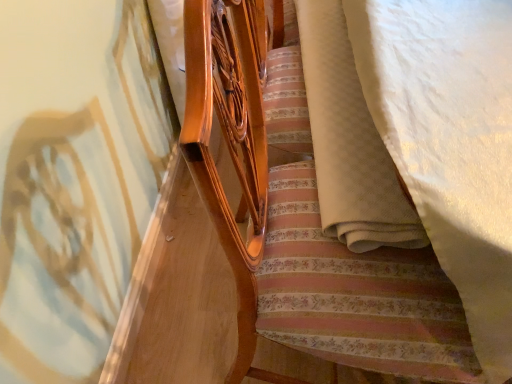
Question: In terms of height, does white textured blanket at lower right look taller or shorter compared to matte wood bed frame at center?

Choices:
 (A) tall
 (B) short

Answer: (B)

Question: In the image, is white textured blanket at lower right on the left side or the right side of matte wood bed frame at center?

Choices:
 (A) right
 (B) left

Answer: (A)

Question: From the image's perspective, is white textured blanket at lower right located above or below matte wood bed frame at center?

Choices:
 (A) below
 (B) above

Answer: (B)

Question: From the image's perspective, is matte wood bed frame at center above or below white textured blanket at lower right?

Choices:
 (A) below
 (B) above

Answer: (A)

Question: Considering the relative positions of matte wood bed frame at center and white textured blanket at lower right in the image provided, is matte wood bed frame at center to the left or to the right of white textured blanket at lower right?

Choices:
 (A) right
 (B) left

Answer: (B)

Question: Is point (483, 360) closer or farther from the camera than point (360, 132)?

Choices:
 (A) closer
 (B) farther

Answer: (A)

Question: From a real-world perspective, is matte wood bed frame at center above or below white textured blanket at lower right?

Choices:
 (A) below
 (B) above

Answer: (A)